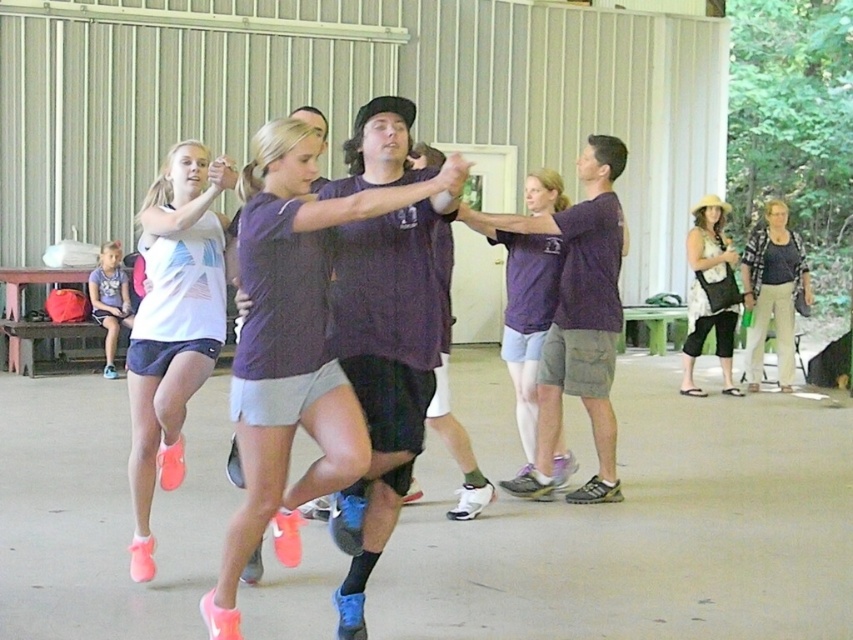
Which of these two, pink matte shorts at center or purple cotton shorts at center, stands shorter?

Standing shorter between the two is purple cotton shorts at center.

Is pink matte shorts at center further to the viewer compared to purple cotton shorts at center?

No, it is not.

You are a GUI agent. You are given a task and a screenshot of the screen. Output one action in this format:
    pyautogui.click(x=<x>, y=<y>)
    Task: Click on the pink matte shorts at center
    
    Given the screenshot: What is the action you would take?
    pyautogui.click(x=173, y=324)

Which of these two, pink matte shorts at center or purple cotton t-shirt at center, stands shorter?

With less height is pink matte shorts at center.

What do you see at coordinates (173, 324) in the screenshot? I see `pink matte shorts at center` at bounding box center [173, 324].

Where is `pink matte shorts at center`? The width and height of the screenshot is (853, 640). pink matte shorts at center is located at coordinates (173, 324).

Does point (317, 444) come farther from viewer compared to point (527, 195)?

That is False.

Is purple matte t-shirt at center to the left of purple cotton shorts at center from the viewer's perspective?

Correct, you'll find purple matte t-shirt at center to the left of purple cotton shorts at center.

Is point (287, 330) positioned after point (509, 316)?

That is False.

Locate an element on the screen. The width and height of the screenshot is (853, 640). purple matte t-shirt at center is located at coordinates (292, 348).